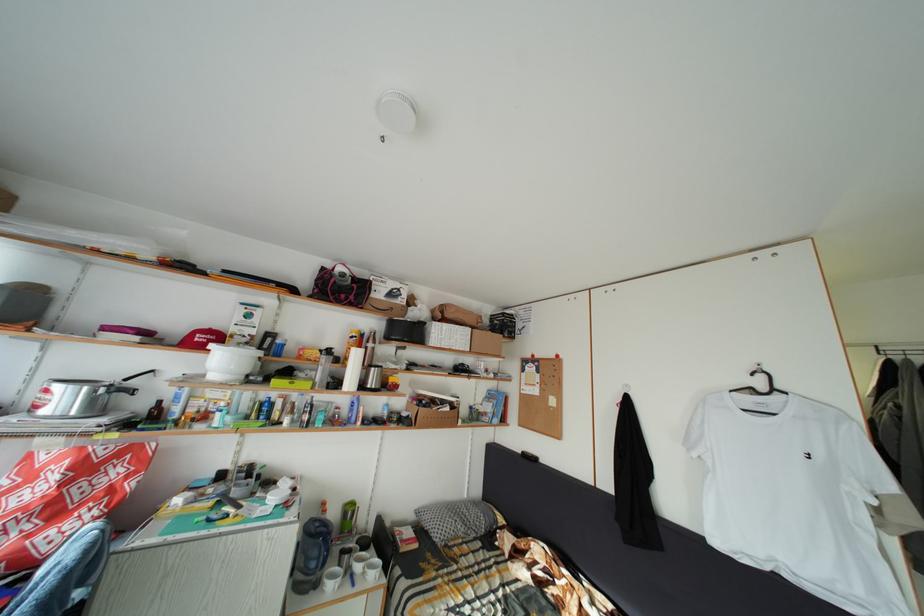
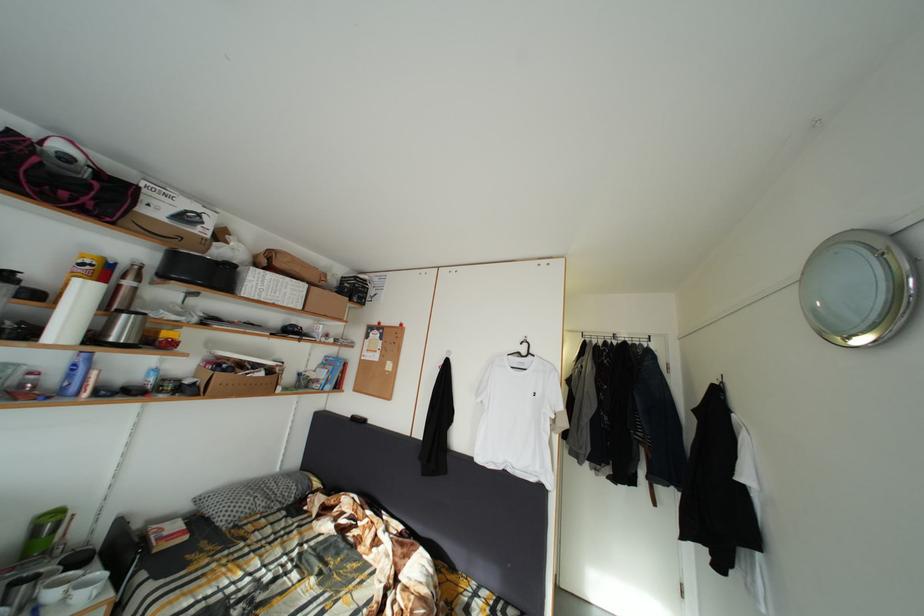
Locate, in the second image, the point that corresponds to (x=378, y=392) in the first image.

(120, 345)